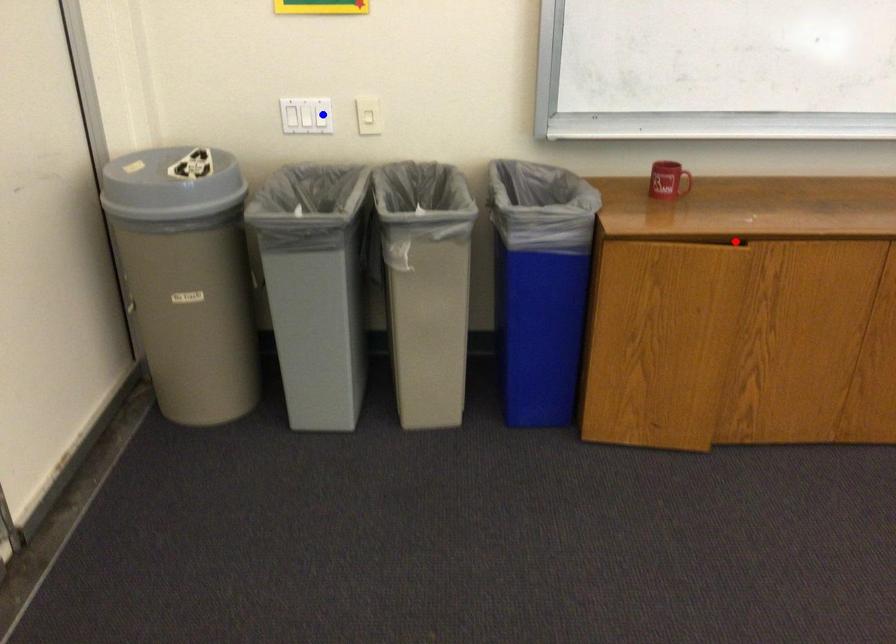
Question: Two points are marked on the image. Which point is closer to the camera?

Choices:
 (A) Blue point is closer.
 (B) Red point is closer.

Answer: (B)